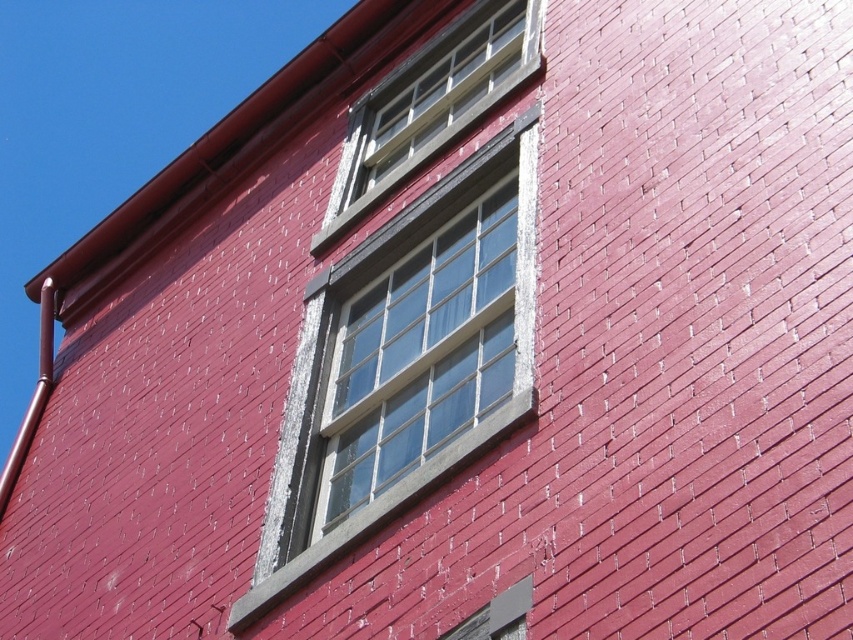
Question: Does clear glass window at center have a greater width compared to clear glass window at upper center?

Choices:
 (A) yes
 (B) no

Answer: (B)

Question: Can you confirm if clear glass window at center is thinner than clear glass window at upper center?

Choices:
 (A) no
 (B) yes

Answer: (B)

Question: Can you confirm if clear glass window at center is bigger than clear glass window at upper center?

Choices:
 (A) no
 (B) yes

Answer: (B)